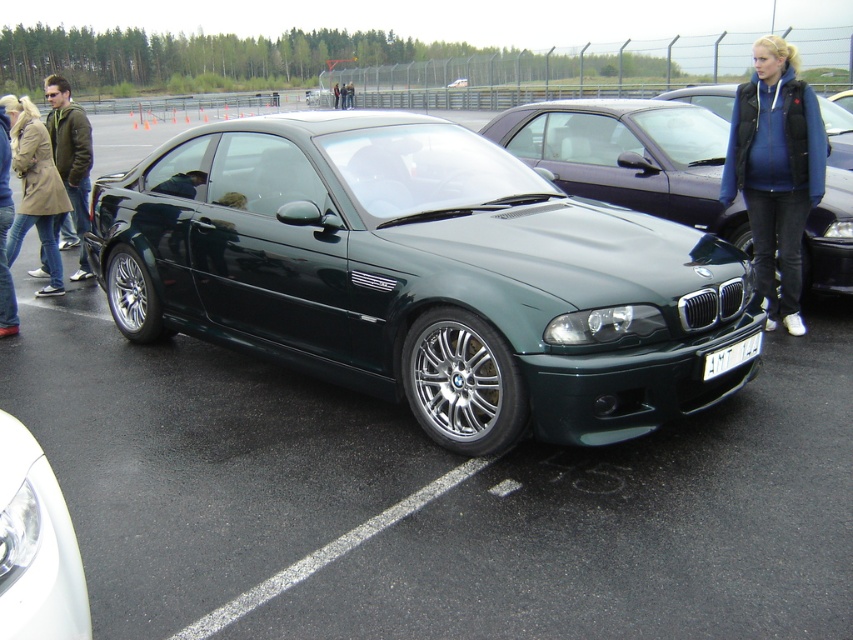
Question: Is tan leather coat at left in front of white plastic license plate at center?

Choices:
 (A) yes
 (B) no

Answer: (B)

Question: Is metallic green sports car at center smaller than green metallic car at center?

Choices:
 (A) yes
 (B) no

Answer: (A)

Question: Which point is closer to the camera?

Choices:
 (A) (318, 99)
 (B) (1, 253)
 (C) (41, 236)
 (D) (27, 580)

Answer: (D)

Question: Which point is farther to the camera?

Choices:
 (A) blue fleece jacket at upper right
 (B) tan leather coat at left
 (C) metallic green sports car at center

Answer: (B)

Question: Does jeans at left appear on the left side of white plastic license plate at center?

Choices:
 (A) yes
 (B) no

Answer: (A)

Question: Which point is closer to the camera?

Choices:
 (A) khaki fabric coat at left
 (B) tan leather coat at left

Answer: (B)